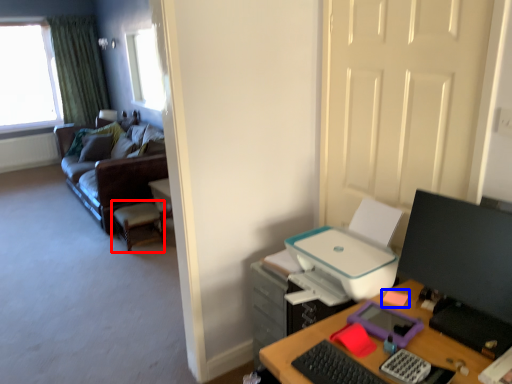
Question: Among these objects, which one is farthest to the camera, computer chair (highlighted by a red box) or stationery (highlighted by a blue box)?

Choices:
 (A) computer chair
 (B) stationery

Answer: (A)